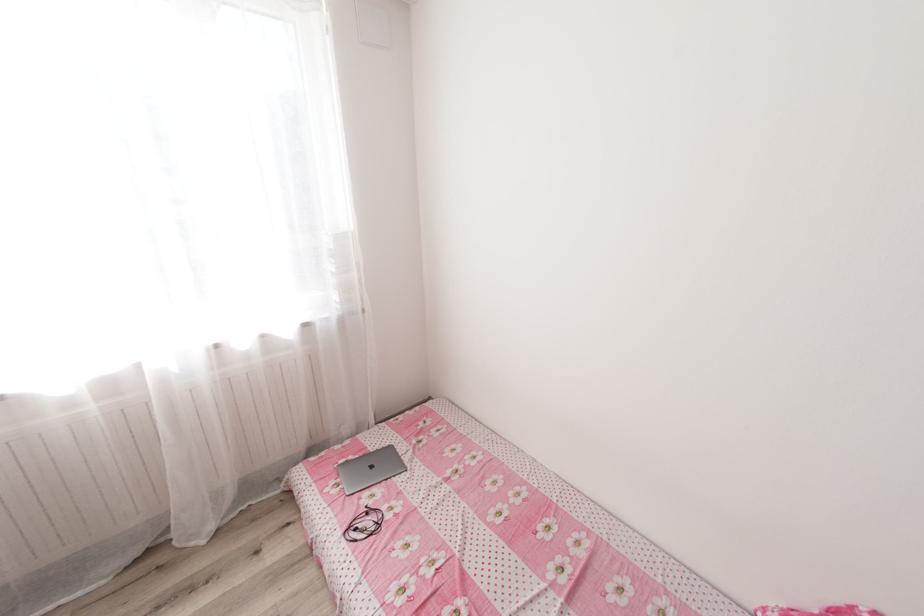
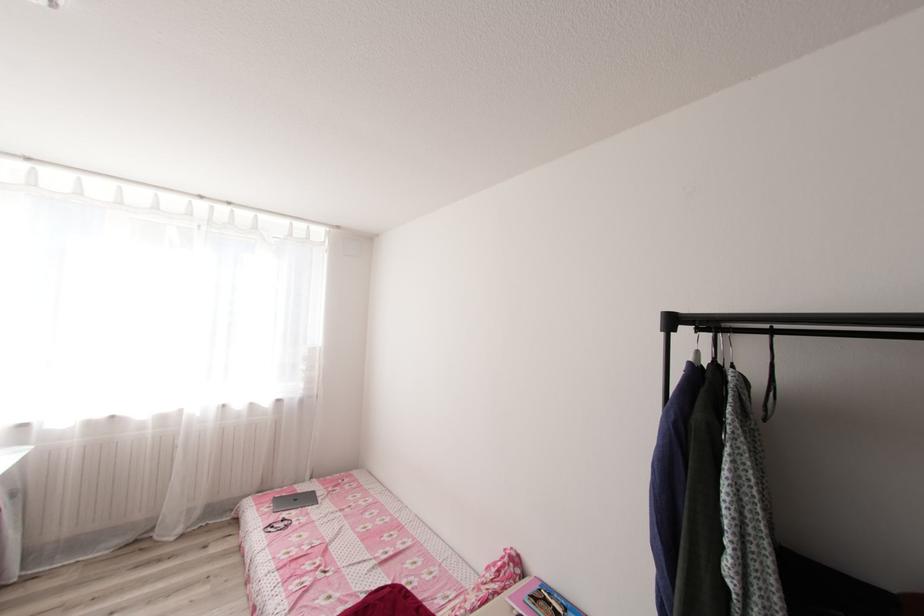
The point at (377, 467) is marked in the first image. Where is the corresponding point in the second image?

(300, 499)